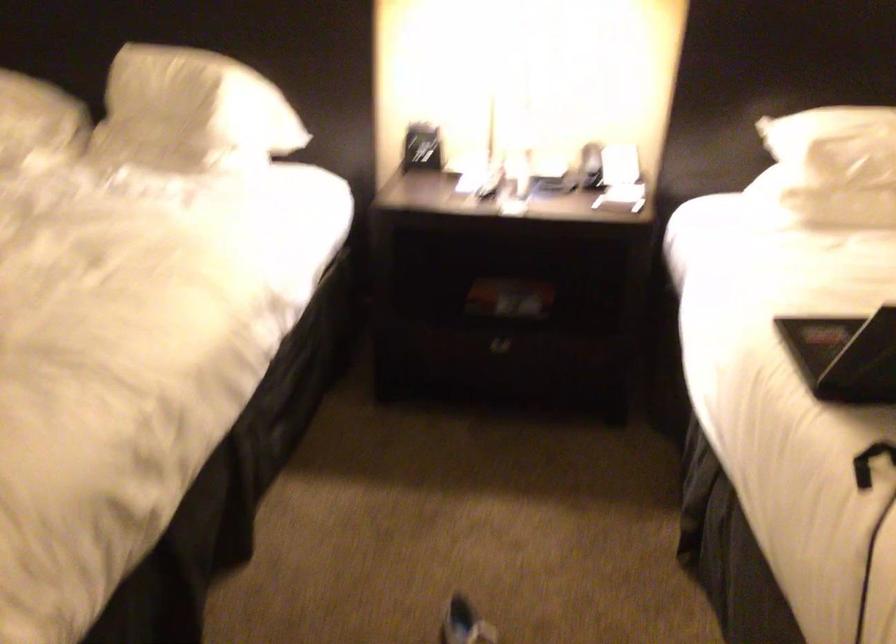
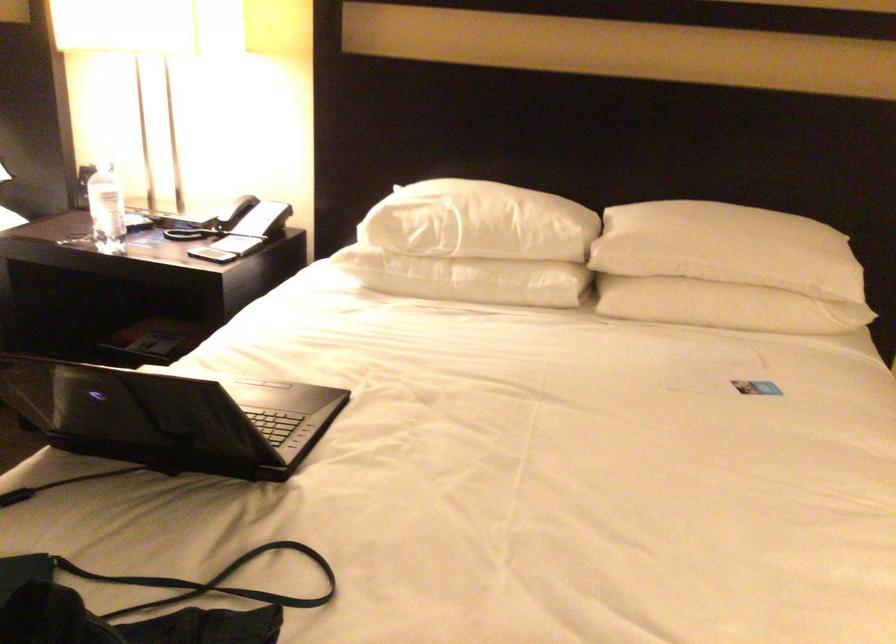
Find the pixel in the second image that matches pixel 414 107 in the first image.

(104, 160)